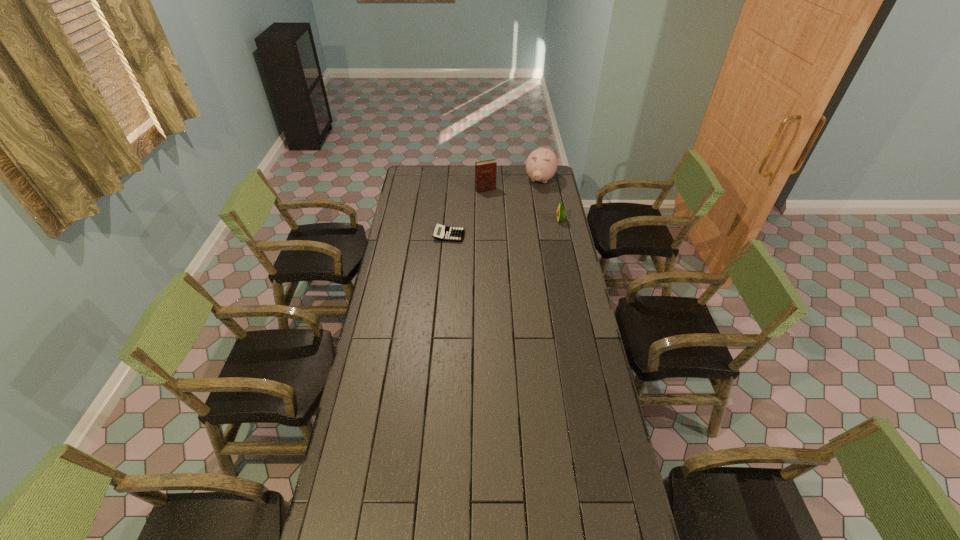
This screenshot has height=540, width=960. I want to click on vacant area at the far edge of the desktop, so click(474, 175).

Where is `vacant area at the near edge of the desktop`? The width and height of the screenshot is (960, 540). vacant area at the near edge of the desktop is located at coordinates (539, 518).

This screenshot has height=540, width=960. Find the location of `free location at the left edge`. free location at the left edge is located at coordinates (385, 355).

What are the coordinates of `free space at the right edge` in the screenshot? It's located at (560, 260).

Locate an element on the screen. vacant space at the near left corner of the desktop is located at coordinates (376, 515).

Locate an element on the screen. vacant point located between the piggy bank and the diary is located at coordinates pyautogui.click(x=513, y=185).

Image resolution: width=960 pixels, height=540 pixels. In order to click on free space between the piggy bank and the diary in this screenshot , I will do `click(513, 185)`.

Where is `empty space between the second shortest object and the piggy bank`? The width and height of the screenshot is (960, 540). empty space between the second shortest object and the piggy bank is located at coordinates (550, 200).

Where is `vacant area that lies between the nearest object and the second shortest object`? The image size is (960, 540). vacant area that lies between the nearest object and the second shortest object is located at coordinates (505, 228).

Locate an element on the screen. Image resolution: width=960 pixels, height=540 pixels. vacant region between the piggy bank and the shortest object is located at coordinates (494, 208).